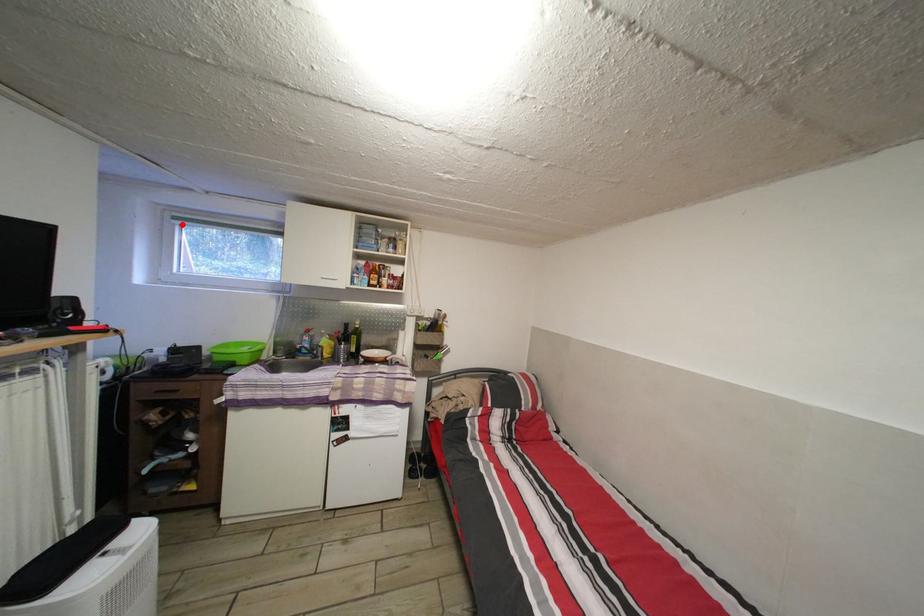
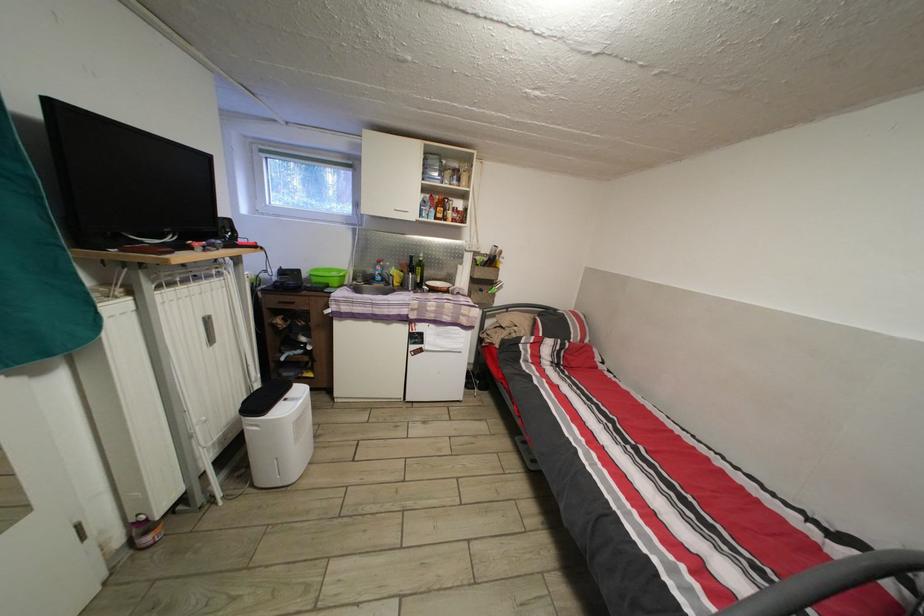
Question: A red point is marked in image1. In image2, is the corresponding 3D point closer to the camera or farther? Reply with the corresponding letter.

Choices:
 (A) The corresponding 3D point is closer.
 (B) The corresponding 3D point is farther.

Answer: (B)